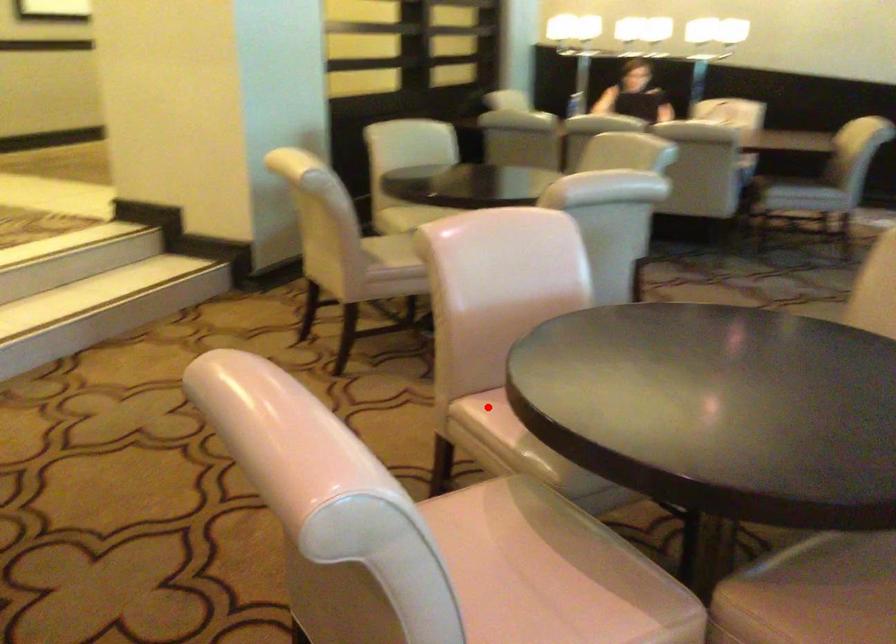
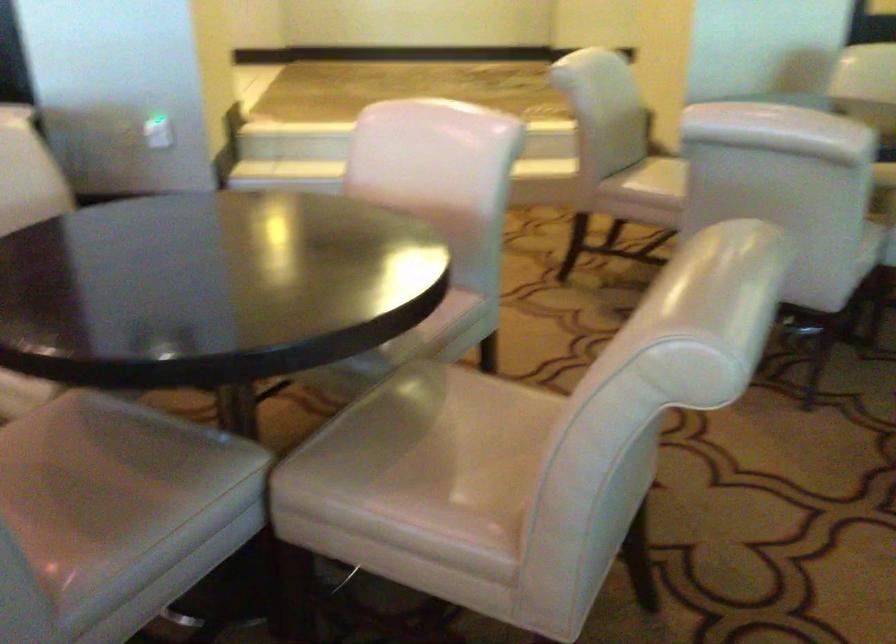
Question: I am providing you with two images of the same scene from different viewpoints. A red point is marked on the first image. Is the red point's position out of view in image 2?

Choices:
 (A) Yes
 (B) No

Answer: (A)